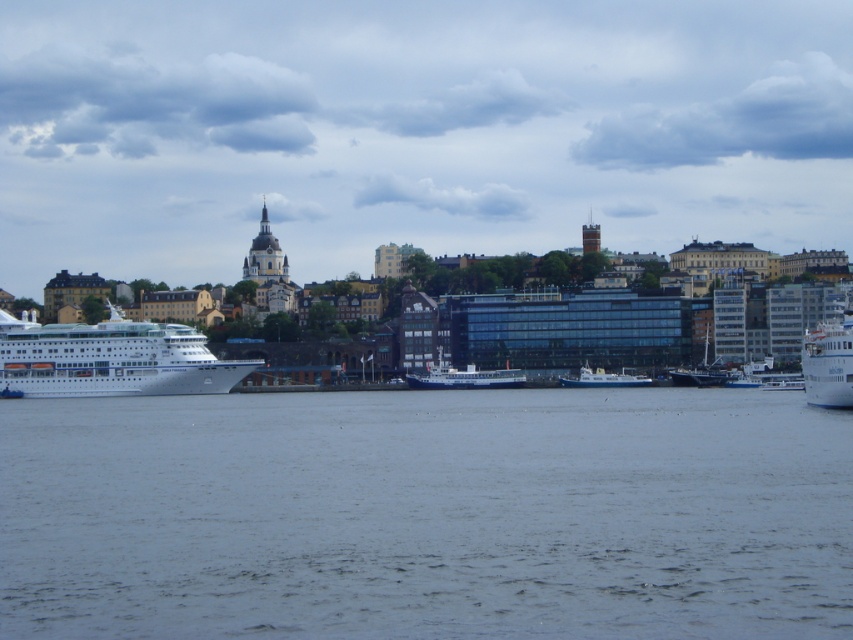
Question: Which of these objects is positioned farthest from the white glossy ferry at right?

Choices:
 (A) gray water at center
 (B) white matte ship at center
 (C) blue metallic boat at center

Answer: (B)

Question: Can you confirm if white glossy ferry at right is positioned to the right of white matte ship at center?

Choices:
 (A) yes
 (B) no

Answer: (A)

Question: Which point is closer to the camera?

Choices:
 (A) (206, 380)
 (B) (840, 349)
 (C) (477, 385)

Answer: (B)

Question: Estimate the real-world distances between objects in this image. Which object is farther from the white matte boat at center?

Choices:
 (A) white glossy ferry at right
 (B) blue metallic boat at center
 (C) white matte ship at center
 (D) gray water at center

Answer: (D)

Question: Can you confirm if white glossy ferry at right is positioned to the left of white matte boat at center?

Choices:
 (A) no
 (B) yes

Answer: (A)

Question: Does white glossy cruise ship at left appear on the left side of white glossy ferry at right?

Choices:
 (A) no
 (B) yes

Answer: (B)